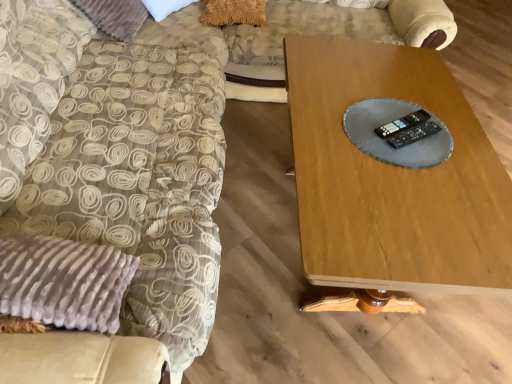
Identify the location of free location in front of black plastic remote at center, which is the first control from bottom to top. (421, 173).